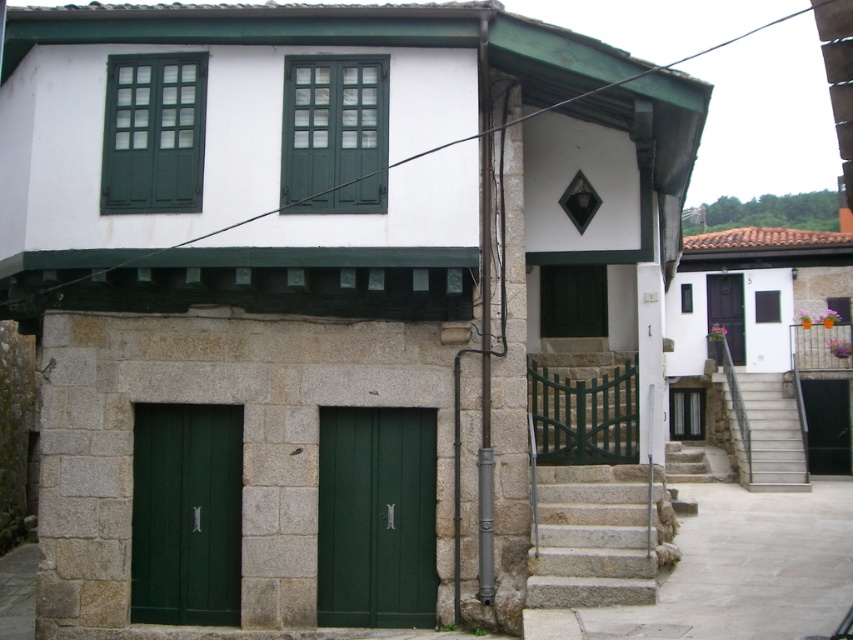
Based on the photo, who is positioned more to the left, granite steps at lower center or concrete stairs at lower right?

granite steps at lower center is more to the left.

The width and height of the screenshot is (853, 640). What do you see at coordinates (598, 536) in the screenshot?
I see `granite steps at lower center` at bounding box center [598, 536].

Is point (653, 548) closer to camera compared to point (804, 452)?

Yes, point (653, 548) is closer to viewer.

Identify the location of granite steps at lower center. (598, 536).

Does green matte door at lower left have a smaller size compared to black matte door at center?

No, green matte door at lower left is not smaller than black matte door at center.

Can you confirm if green matte door at lower left is thinner than black matte door at center?

No, green matte door at lower left is not thinner than black matte door at center.

This screenshot has height=640, width=853. What do you see at coordinates (186, 513) in the screenshot? I see `green matte door at lower left` at bounding box center [186, 513].

The image size is (853, 640). Identify the location of green matte door at lower left. (186, 513).

Between point (149, 106) and point (704, 452), which one is positioned in front?

Positioned in front is point (149, 106).

Does green matte window at upper left appear under stone stairs at lower right?

No.

I want to click on green matte window at upper left, so click(154, 132).